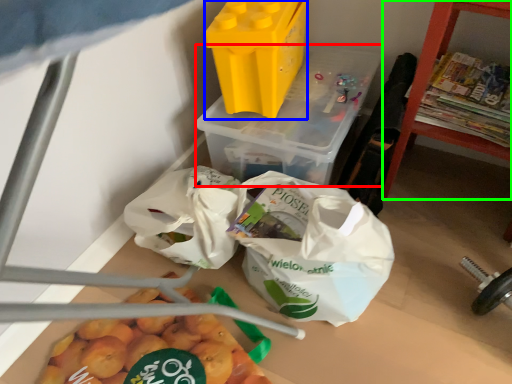
Question: Based on their relative distances, which object is nearer to yoghurt (highlighted by a red box)? Choose from yoghurt (highlighted by a blue box) and furniture (highlighted by a green box).

Choices:
 (A) yoghurt
 (B) furniture

Answer: (A)